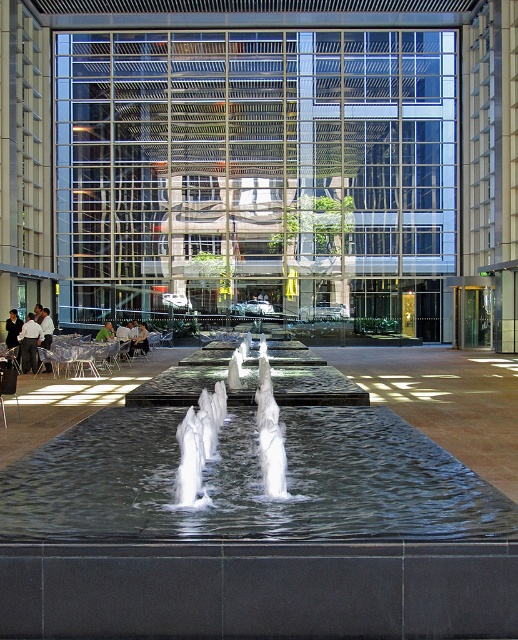
You are standing in the atrium and want to take a photo of the water jets. To avoid reflections from the glass facade, you need to position yourself so that the clear water jets at center are to your left. Where should you place the clear water at center in your photo?

The clear water at center is positioned on the right side of the clear water jets at center, so to have the clear water jets at center to your left, you should position the clear water at center to the right of the clear water jets at center in your photo.

From the picture: You are standing in the atrium and want to take a photo of the clear water jets at center. If your camera requires you to be at least 4 meters away from the subject to avoid distortion, can you safely take the photo without moving closer?

The clear water jets at center and camera are 4.43 meters apart from each other. Since 4.43 meters is more than the required 4 meters, you can safely take the photo without moving closer.

You are standing in the atrium and want to walk from the water feature to the glass facade. You notice two points marked in the image. Which point, point [346,474] or point [24,356], is closer to your current position?

Point [346,474] is closer to the viewer than point [24,356], so the closer point to your current position is point [346,474].